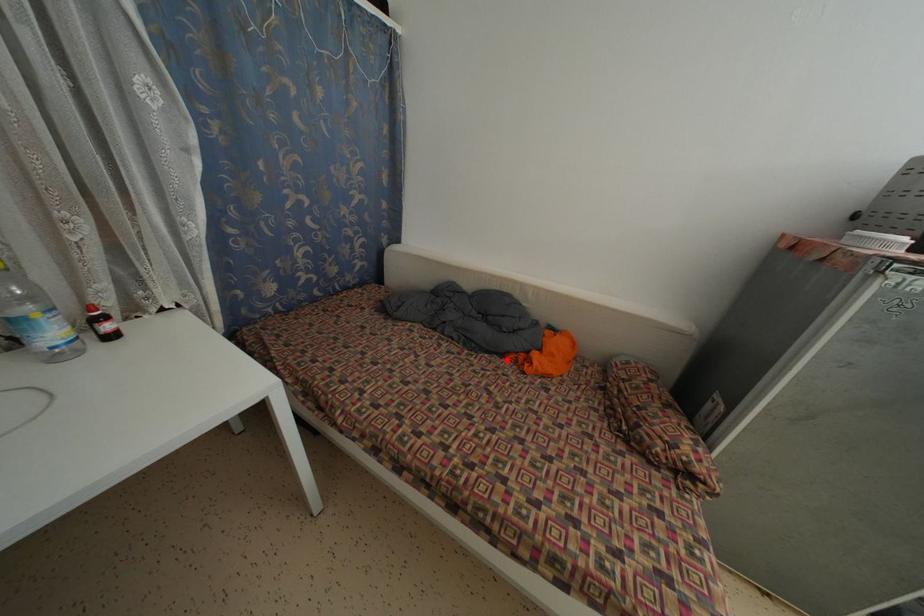
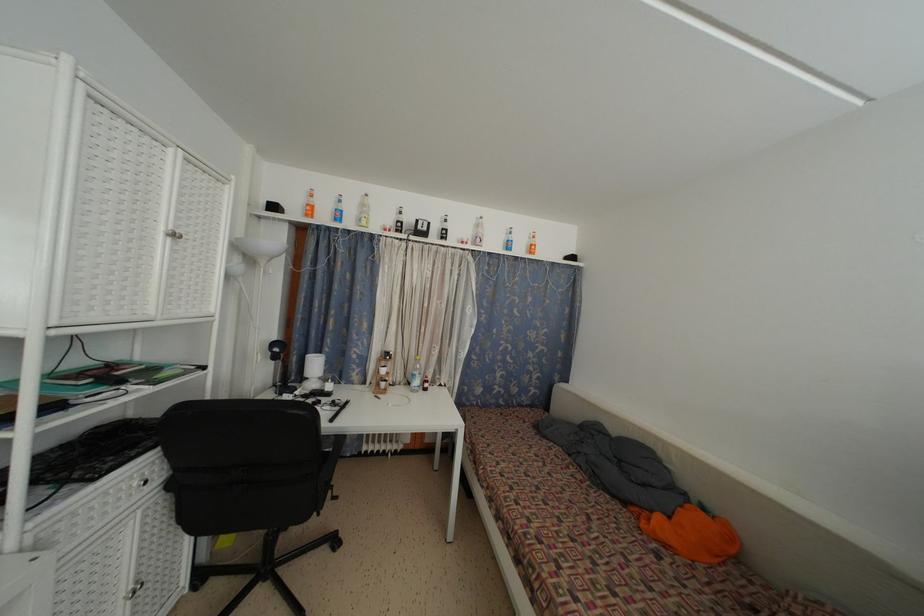
The point at the highlighted location is marked in the first image. Where is the corresponding point in the second image?

(629, 509)